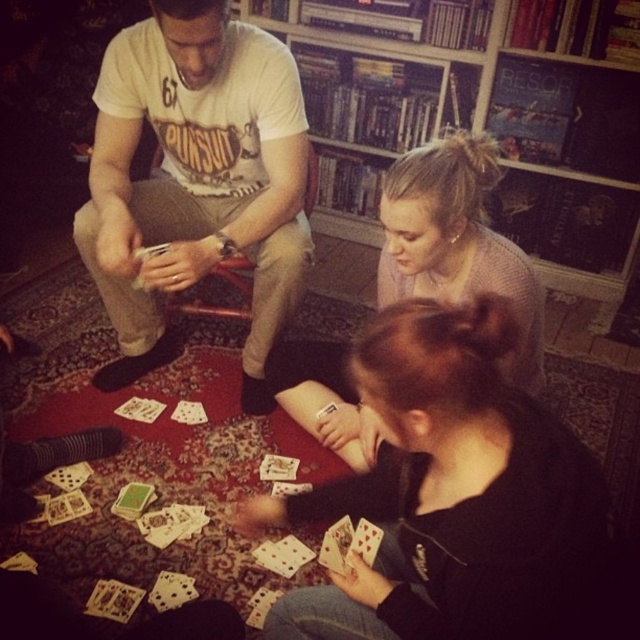
Is white cotton t-shirt at center to the left of wooden bookshelf at upper center from the viewer's perspective?

Yes, white cotton t-shirt at center is to the left of wooden bookshelf at upper center.

This screenshot has height=640, width=640. I want to click on white cotton t-shirt at center, so click(195, 179).

Is wooden bookshelf at upper center smaller than smooth pink sweater at center?

No.

Between point (330, 42) and point (480, 259), which one is positioned behind?

Point (330, 42)

Is point (476, 125) in front of point (410, 172)?

No, it is not.

Locate an element on the screen. The width and height of the screenshot is (640, 640). wooden bookshelf at upper center is located at coordinates (470, 129).

Is the position of white cotton t-shirt at center less distant than that of smooth pink sweater at center?

No, white cotton t-shirt at center is further to the viewer.

Does white cotton t-shirt at center appear on the right side of smooth pink sweater at center?

No, white cotton t-shirt at center is not to the right of smooth pink sweater at center.

Between point (296, 132) and point (465, 218), which one is positioned in front?

Point (465, 218) is in front.

Identify the location of white cotton t-shirt at center. (195, 179).